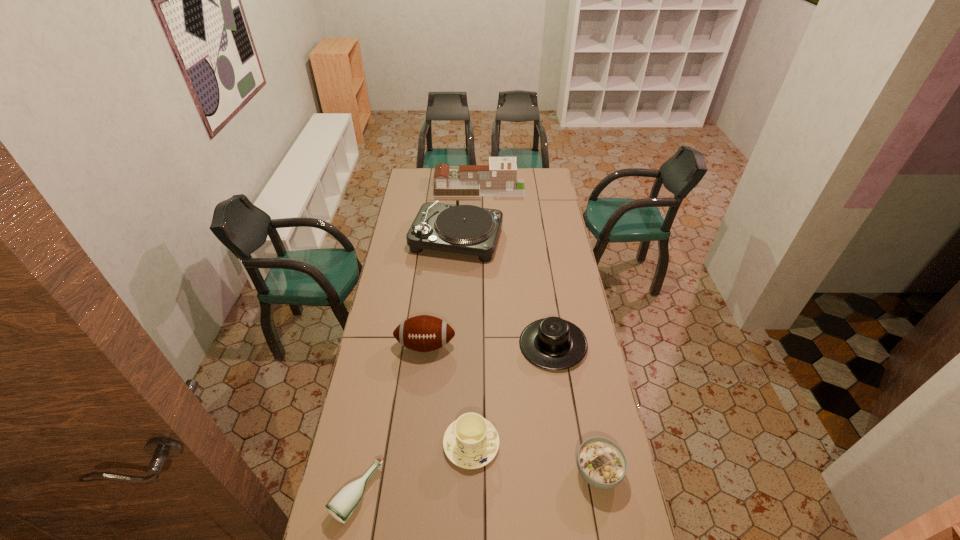
You are a GUI agent. You are given a task and a screenshot of the screen. Output one action in this format:
    pyautogui.click(x=<x>, y=<y>)
    Task: Click on the vacant point located between the shortest object and the second farthest object
    
    Given the screenshot: What is the action you would take?
    pyautogui.click(x=407, y=367)

Locate which object is the fourth closest to the sixth nearest object. Please provide its 2D coordinates. Your answer should be formatted as a tuple, i.e. [(x, y)], where the tuple contains the x and y coordinates of a point satisfying the conditions above.

[(470, 442)]

Locate which object is the fifth closest to the tallest object. Please provide its 2D coordinates. Your answer should be formatted as a tuple, i.e. [(x, y)], where the tuple contains the x and y coordinates of a point satisfying the conditions above.

[(601, 462)]

Where is `vacant area in the image that satisfies the following two spatial constraints: 1. on the laces of the sixth tallest object; 2. on the right side of the football`? The width and height of the screenshot is (960, 540). vacant area in the image that satisfies the following two spatial constraints: 1. on the laces of the sixth tallest object; 2. on the right side of the football is located at coordinates (411, 472).

Locate an element on the screen. vacant position in the image that satisfies the following two spatial constraints: 1. on the handle side of the chinaware; 2. on the right side of the second shortest object is located at coordinates (470, 472).